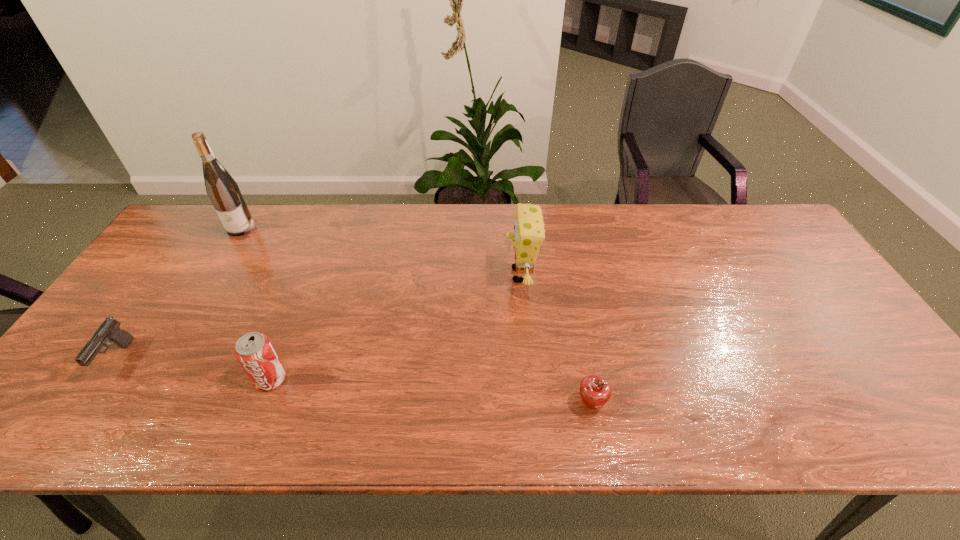
The image size is (960, 540). In order to click on free space between the rightmost object and the leftmost object in this screenshot , I will do `click(354, 381)`.

Where is `vacant space in between the soda can and the fourth shortest object`? This screenshot has height=540, width=960. vacant space in between the soda can and the fourth shortest object is located at coordinates (396, 327).

This screenshot has width=960, height=540. Identify the location of free space between the tallest object and the third object from left to right. (256, 303).

At what (x,y) coordinates should I click in order to perform the action: click on free space between the second tallest object and the third object from left to right. Please return your answer as a coordinate pair (x, y). Looking at the image, I should click on (396, 327).

Where is `vacant space in between the pistol and the tallest object`? This screenshot has height=540, width=960. vacant space in between the pistol and the tallest object is located at coordinates (180, 293).

Find the location of a particular element. object identified as the third closest to the third object from right to left is located at coordinates (529, 229).

Locate an element on the screen. object that ranks as the second closest to the pistol is located at coordinates (223, 191).

The width and height of the screenshot is (960, 540). I want to click on free point that satisfies the following two spatial constraints: 1. aim along the barrel of the leftmost object; 2. on the right side of the apple, so click(x=86, y=404).

In order to click on vacant point that satisfies the following two spatial constraints: 1. on the face of the fourth nearest object; 2. aim along the barrel of the pistol in this screenshot , I will do `click(528, 359)`.

You are a GUI agent. You are given a task and a screenshot of the screen. Output one action in this format:
    pyautogui.click(x=<x>, y=<y>)
    Task: Click on the blank area in the image that satisfies the following two spatial constraints: 1. on the front side of the third object from left to right; 2. on the left side of the wine bottle
    
    Given the screenshot: What is the action you would take?
    pyautogui.click(x=149, y=379)